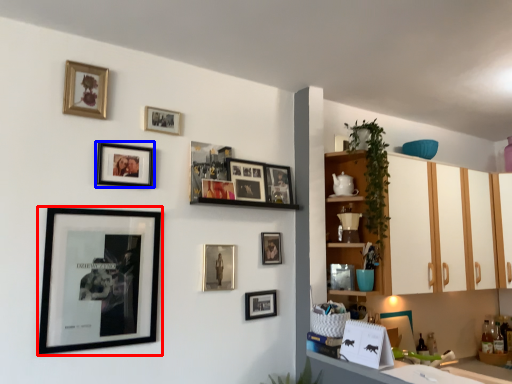
Question: Which of the following is the closest to the observer, picture frame (highlighted by a red box) or picture frame (highlighted by a blue box)?

Choices:
 (A) picture frame
 (B) picture frame

Answer: (A)